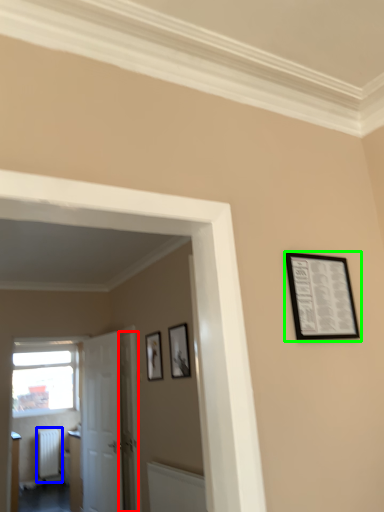
Question: Which object is the farthest from door (highlighted by a red box)? Choose among these: radiator (highlighted by a blue box) or picture frame (highlighted by a green box).

Choices:
 (A) radiator
 (B) picture frame

Answer: (B)